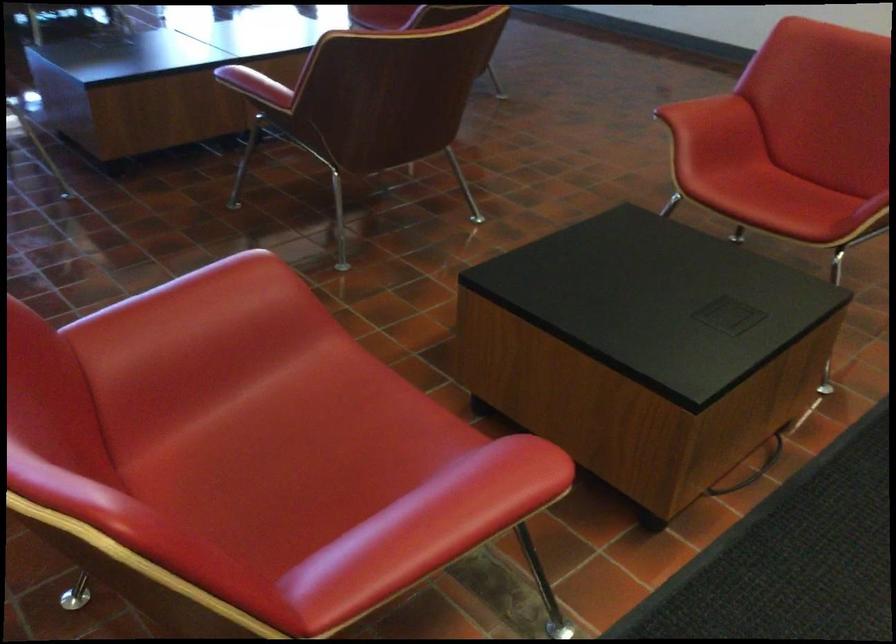
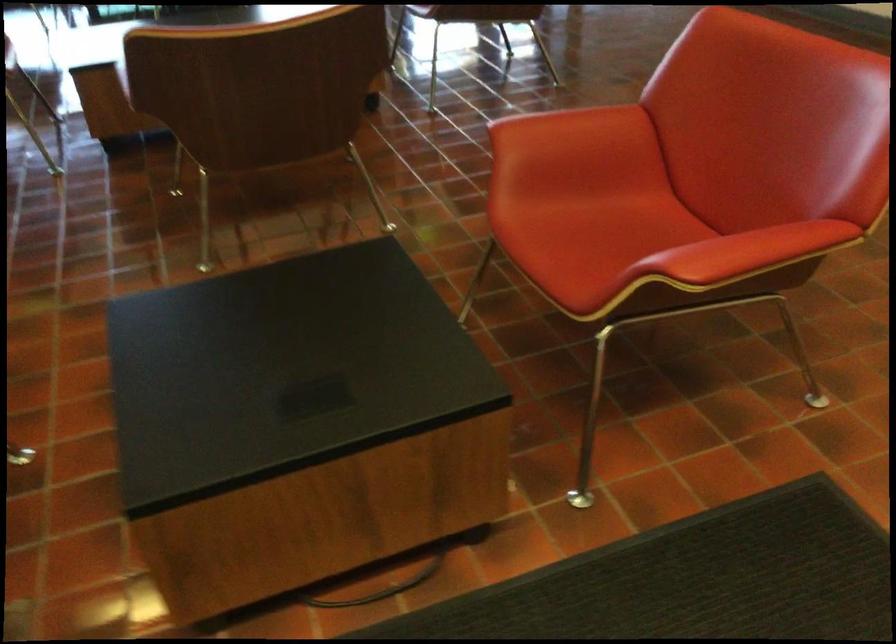
In a continuous first-person perspective shot, in which direction is the camera moving?

The movement direction of the cameraman is right, forward.